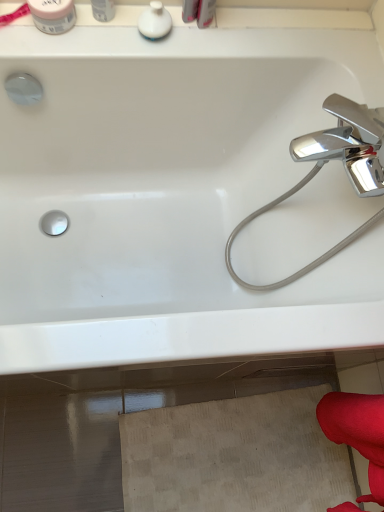
Image resolution: width=384 pixels, height=512 pixels. Identify the location of vacant region in front of white glossy container at upper left, acting as the 2th toiletry starting from the right. (81, 48).